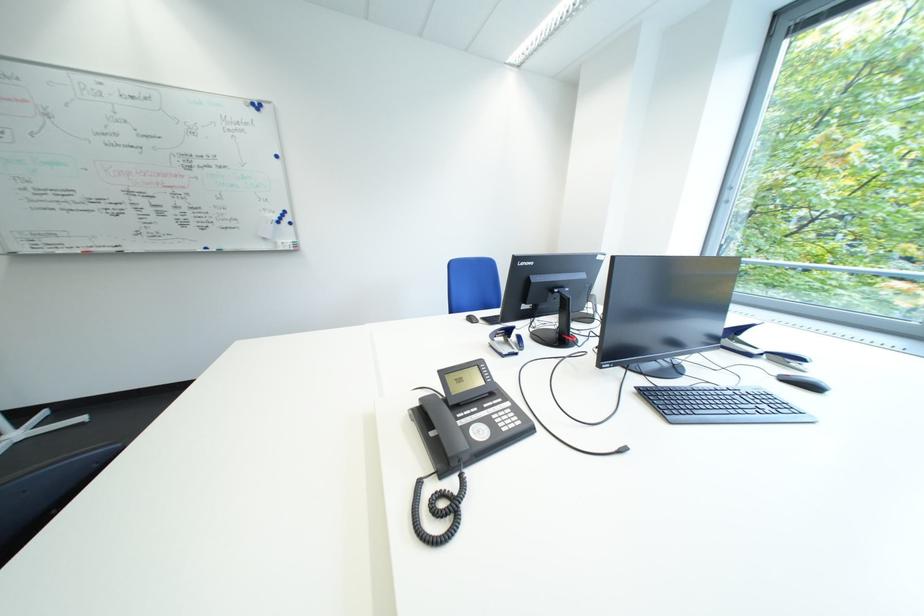
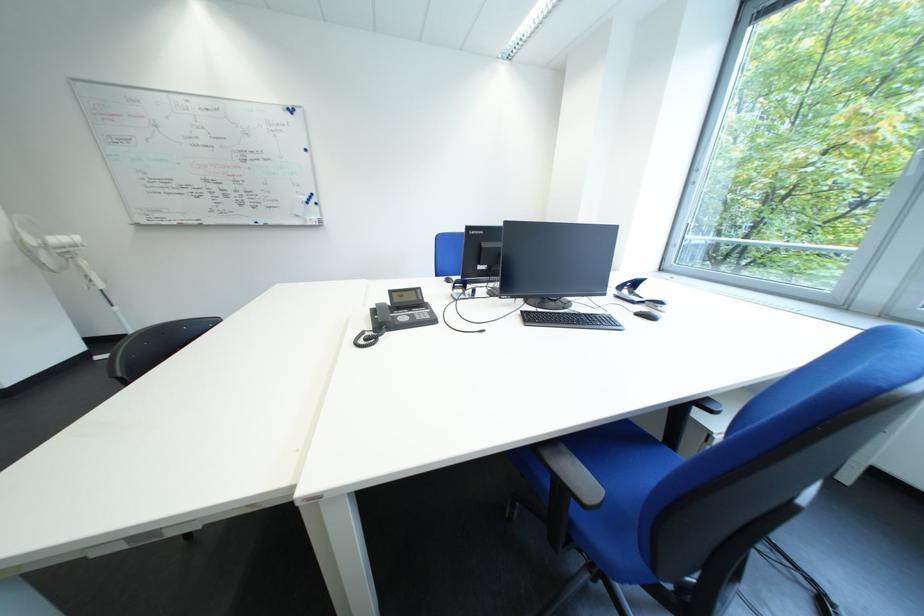
Question: The camera is either moving clockwise (left) or counter-clockwise (right) around the object. The first image is from the beginning of the video and the second image is from the end. Is the camera moving left or right when shooting the video?

Choices:
 (A) Left
 (B) Right

Answer: (B)